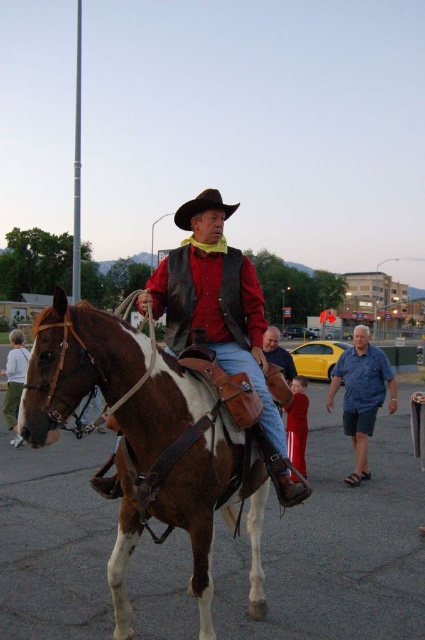
You are a photographer trying to capture the rider and his horse. You notice a light gray sweater at lower left and a brown leather cowboy hat at center. Which object should you focus on first if you want to photograph the rider from the ground up?

The light gray sweater at lower left is located below the brown leather cowboy hat at center, so you should focus on the brown leather cowboy hat at center first as it is higher up.

You are a photographer trying to capture a clear photo of the brown leather cowboy hat at center and the brown leather horse at center. Since the horse is moving, you want to focus on the hat first. Which object should you aim your camera at first to ensure you capture it before the horse moves further away?

The brown leather horse at center is to the right of the brown leather cowboy hat at center. Since the horse is moving, you should aim your camera at the brown leather cowboy hat at center first before it moves further away.